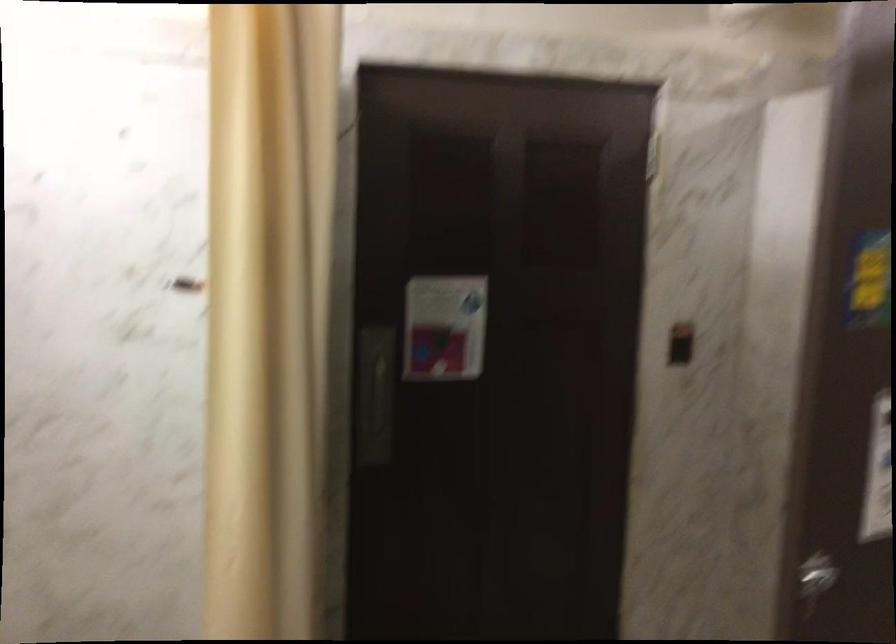
Identify the location of silver door handle. Image resolution: width=896 pixels, height=644 pixels. (815, 574).